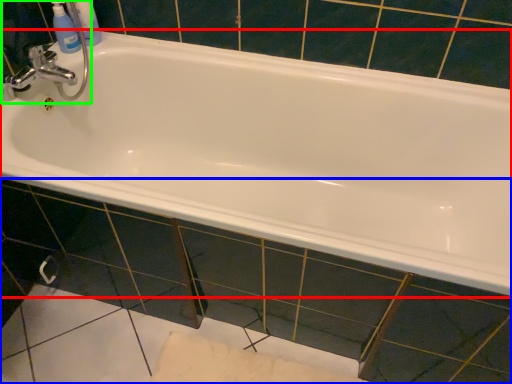
Question: Which object is positioned farthest from bathtub (highlighted by a red box)? Select from tile (highlighted by a blue box) and sink (highlighted by a green box).

Choices:
 (A) tile
 (B) sink

Answer: (B)